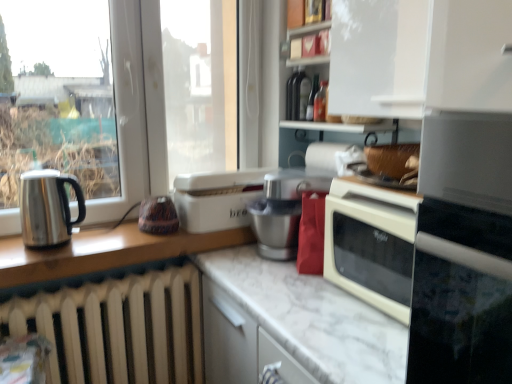
Question: Is white glossy shelf at upper center touching white marble countertop at center?

Choices:
 (A) yes
 (B) no

Answer: (B)

Question: Is white glossy shelf at upper center further to camera compared to white marble countertop at center?

Choices:
 (A) no
 (B) yes

Answer: (B)

Question: Is white glossy shelf at upper center smaller than white marble countertop at center?

Choices:
 (A) yes
 (B) no

Answer: (A)

Question: Is white glossy shelf at upper center not within white marble countertop at center?

Choices:
 (A) yes
 (B) no

Answer: (A)

Question: Is white glossy shelf at upper center aimed at white marble countertop at center?

Choices:
 (A) yes
 (B) no

Answer: (B)

Question: Considering the relative positions of white glossy shelf at upper center and white marble countertop at center in the image provided, is white glossy shelf at upper center in front of white marble countertop at center?

Choices:
 (A) no
 (B) yes

Answer: (A)

Question: Can you confirm if stainless steel kettle at left, which ranks as the second kitchen appliance in back-to-front order, is taller than white glossy shelf at upper center?

Choices:
 (A) yes
 (B) no

Answer: (B)

Question: Is stainless steel kettle at left, the first kitchen appliance from the front, facing away from white glossy shelf at upper center?

Choices:
 (A) yes
 (B) no

Answer: (B)

Question: Could you tell me if stainless steel kettle at left, the first kitchen appliance from the front, is turned towards white glossy shelf at upper center?

Choices:
 (A) yes
 (B) no

Answer: (B)

Question: Is stainless steel kettle at left, marked as the 1th kitchen appliance in a left-to-right arrangement, bigger than white glossy shelf at upper center?

Choices:
 (A) yes
 (B) no

Answer: (B)

Question: From the image's perspective, would you say stainless steel kettle at left, the first kitchen appliance from the front, is positioned over white glossy shelf at upper center?

Choices:
 (A) yes
 (B) no

Answer: (B)

Question: Does stainless steel kettle at left, which is the second kitchen appliance in right-to-left order, lie behind white glossy shelf at upper center?

Choices:
 (A) no
 (B) yes

Answer: (B)

Question: Is stainless steel kettle at left, which is the second kitchen appliance in right-to-left order, not within white plastic bread bin at center, which is the 1th kitchen appliance from back to front?

Choices:
 (A) no
 (B) yes

Answer: (B)